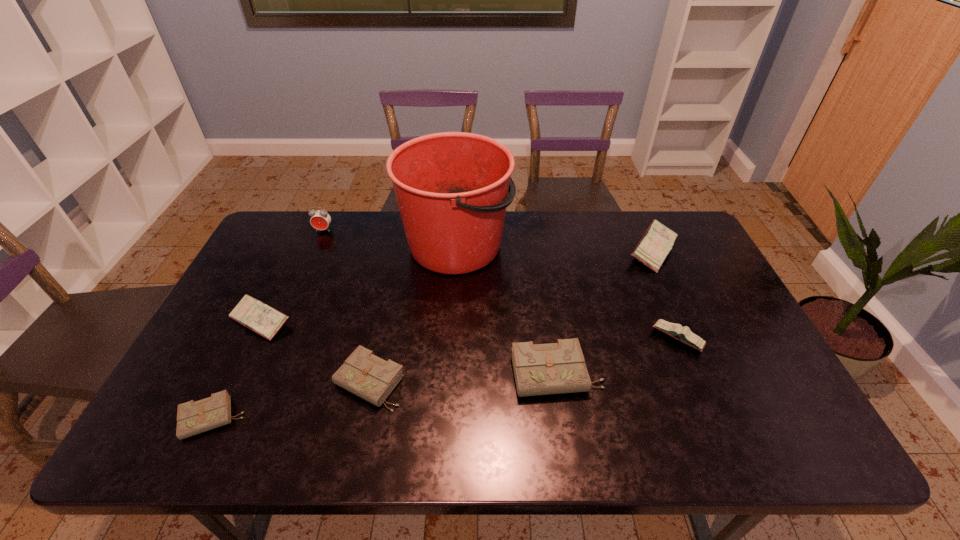
The width and height of the screenshot is (960, 540). Find the location of `bucket`. bucket is located at coordinates (452, 188).

Find the location of a particular element. The width and height of the screenshot is (960, 540). the tallest object is located at coordinates (452, 188).

I want to click on red alarm clock, so click(320, 219).

This screenshot has width=960, height=540. Identify the location of the second tallest object. (320, 219).

Where is `the farthest pink diary`? the farthest pink diary is located at coordinates (652, 249).

Image resolution: width=960 pixels, height=540 pixels. What are the coordinates of `the sixth shortest object` in the screenshot? It's located at (652, 249).

Where is `the rightmost green diary`? The image size is (960, 540). the rightmost green diary is located at coordinates (555, 368).

Where is `the third diary from right to left`? the third diary from right to left is located at coordinates (555, 368).

Where is `the second smallest pink diary`? the second smallest pink diary is located at coordinates (266, 321).

Find the location of a particular element. the second green diary from right to left is located at coordinates (371, 378).